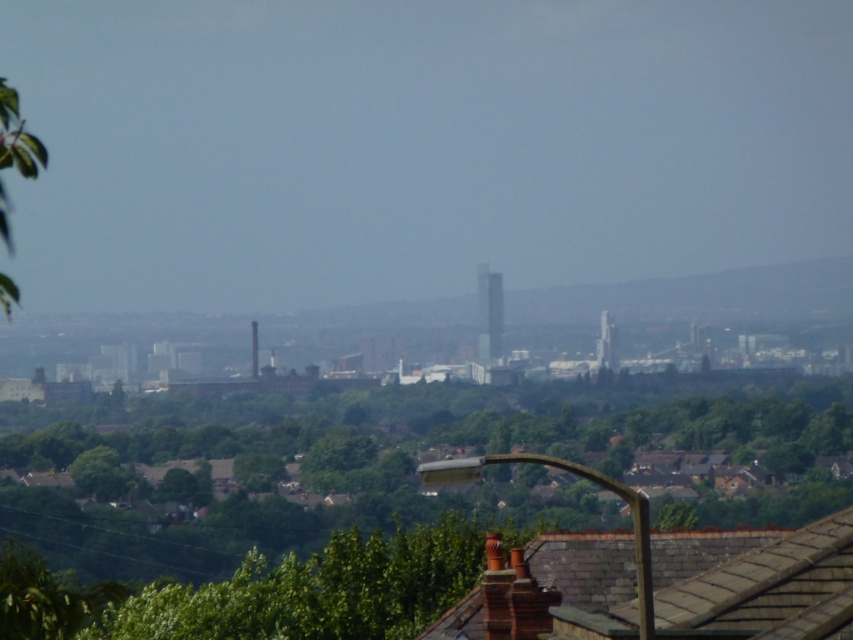
Does green leafy tree at center have a greater width compared to black glass chimney at center?

Yes.

Is green leafy tree at center to the right of black glass chimney at center from the viewer's perspective?

Incorrect, green leafy tree at center is not on the right side of black glass chimney at center.

Which is behind, point (351, 564) or point (490, 342)?

Point (490, 342)

Identify the location of green leafy tree at center. The height and width of the screenshot is (640, 853). (317, 589).

Who is shorter, green leafy tree at left or smooth brick chimney at center?

smooth brick chimney at center is shorter.

Can you confirm if green leafy tree at left is positioned to the right of smooth brick chimney at center?

No, green leafy tree at left is not to the right of smooth brick chimney at center.

What are the coordinates of `green leafy tree at left` in the screenshot? It's located at (16, 138).

Does green leafy tree at left have a smaller size compared to black glass chimney at center?

No.

Is green leafy tree at left positioned before black glass chimney at center?

Yes, green leafy tree at left is closer to the viewer.

I want to click on green leafy tree at left, so click(16, 138).

The image size is (853, 640). I want to click on green leafy tree at left, so click(16, 138).